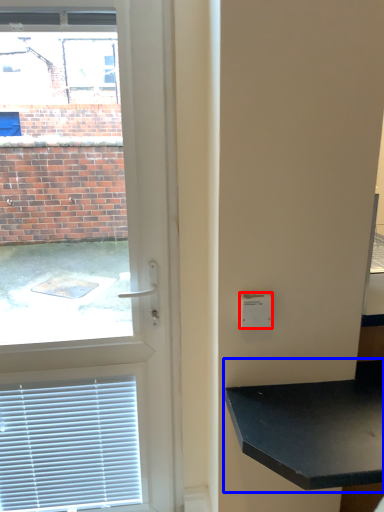
Question: Which object is closer to the camera taking this photo, light switch (highlighted by a red box) or table (highlighted by a blue box)?

Choices:
 (A) light switch
 (B) table

Answer: (B)